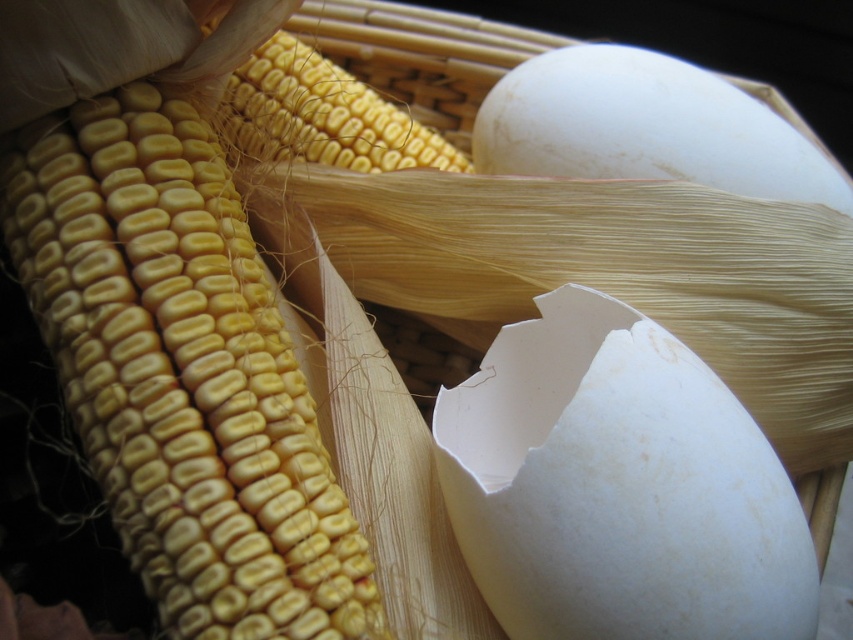
Question: Which object is farther from the camera taking this photo?

Choices:
 (A) white smooth egg at center
 (B) yellow matte corn at left
 (C) yellow matte corn at upper left
 (D) white smooth egg at upper right

Answer: (D)

Question: Which object appears closest to the camera in this image?

Choices:
 (A) white smooth egg at upper right
 (B) yellow matte corn at upper left
 (C) yellow matte corn at left

Answer: (C)

Question: Can you confirm if yellow matte corn at left is wider than yellow matte corn at upper left?

Choices:
 (A) no
 (B) yes

Answer: (B)

Question: Which of the following is the closest to the observer?

Choices:
 (A) white smooth egg at upper right
 (B) white smooth egg at center

Answer: (B)

Question: Is white smooth egg at upper right positioned behind yellow matte corn at upper left?

Choices:
 (A) yes
 (B) no

Answer: (A)

Question: Is white smooth egg at center closer to camera compared to yellow matte corn at upper left?

Choices:
 (A) yes
 (B) no

Answer: (A)